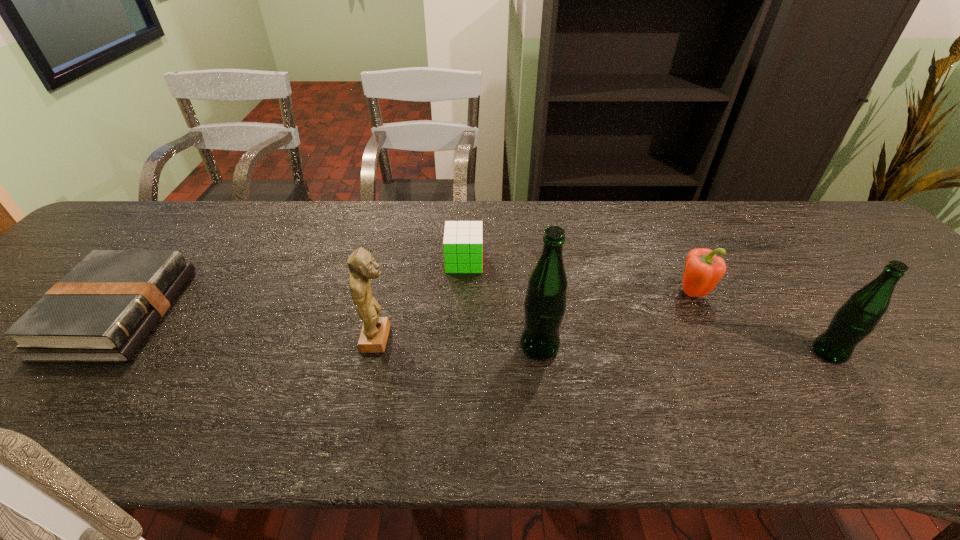
Please point a vacant point for placing a beer bottle on the left. Please provide its 2D coordinates. Your answer should be formatted as a tuple, i.e. [(x, y)], where the tuple contains the x and y coordinates of a point satisfying the conditions above.

[(257, 340)]